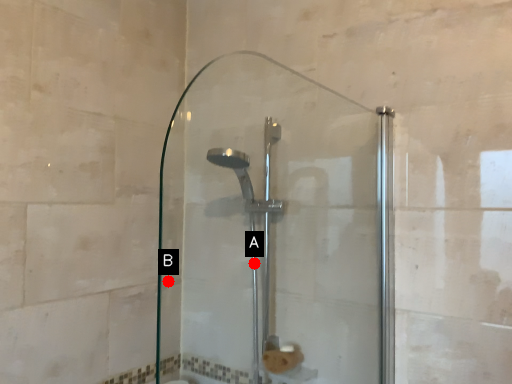
Question: Two points are circled on the image, labeled by A and B beside each circle. Which point is closer to the camera taking this photo?

Choices:
 (A) A is closer
 (B) B is closer

Answer: (A)